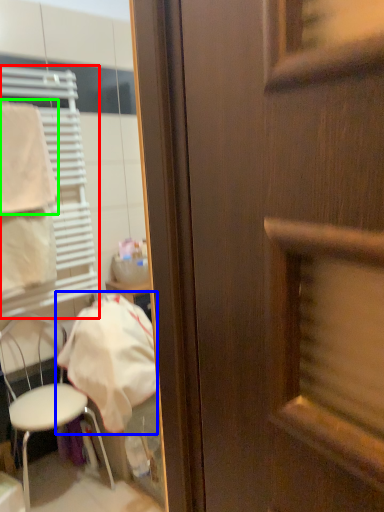
Question: Which object is the closest to the shutter (highlighted by a red box)? Choose among these: cloth (highlighted by a blue box) or towel/napkin (highlighted by a green box).

Choices:
 (A) cloth
 (B) towel/napkin

Answer: (B)